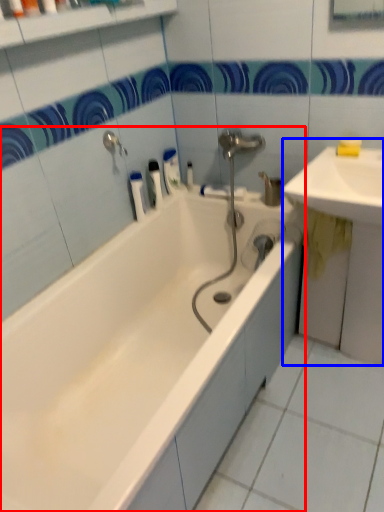
Question: Which of the following is the farthest to the observer, bathtub (highlighted by a red box) or sink (highlighted by a blue box)?

Choices:
 (A) bathtub
 (B) sink

Answer: (B)